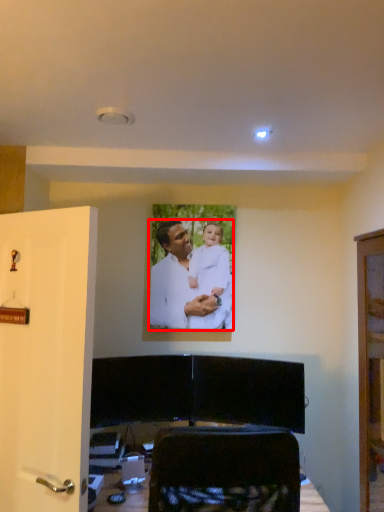
Question: From the image's perspective, considering the relative positions of man (annotated by the red box) and door in the image provided, where is man (annotated by the red box) located with respect to the staircase?

Choices:
 (A) above
 (B) below

Answer: (A)